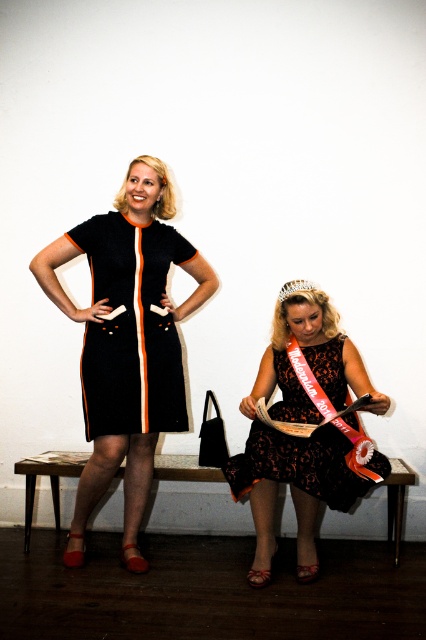
Question: Is black matte dress at upper left below clear crystal tiara at upper center?

Choices:
 (A) yes
 (B) no

Answer: (A)

Question: Estimate the real-world distances between objects in this image. Which object is farther from the matte black dress at center?

Choices:
 (A) black matte dress at upper left
 (B) clear crystal tiara at upper center
 (C) black lace dress at lower center

Answer: (B)

Question: Observing the image, what is the correct spatial positioning of black matte dress at upper left in reference to clear crystal tiara at upper center?

Choices:
 (A) left
 (B) right

Answer: (A)

Question: Based on their relative distances, which object is nearer to the matte black dress at center?

Choices:
 (A) black lace dress at lower center
 (B) black matte dress at upper left
 (C) clear crystal tiara at upper center

Answer: (B)

Question: Is matte black dress at center thinner than black lace dress at lower center?

Choices:
 (A) no
 (B) yes

Answer: (A)

Question: Which object is closer to the camera taking this photo?

Choices:
 (A) black matte dress at upper left
 (B) matte black dress at center
 (C) black lace dress at lower center
 (D) clear crystal tiara at upper center

Answer: (C)